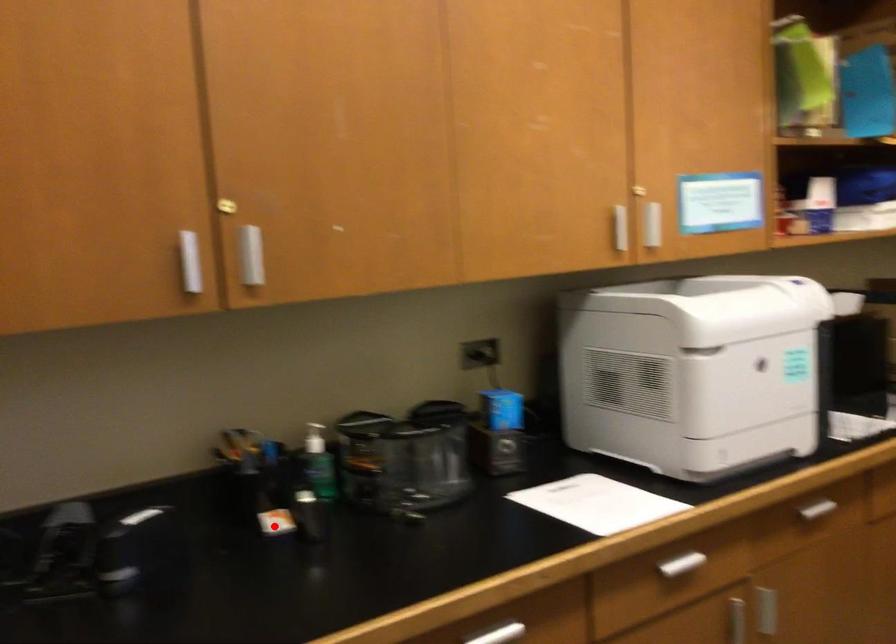
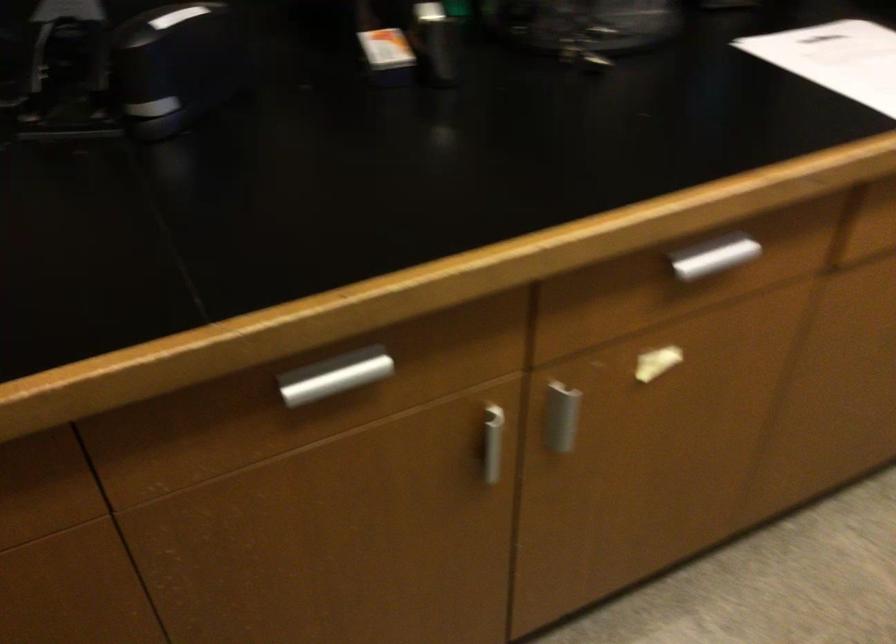
Question: I am providing you with two images of the same scene from different viewpoints. A red point is shown in image1. For the corresponding object point in image2, is it positioned nearer or farther from the camera?

Choices:
 (A) Nearer
 (B) Farther

Answer: (A)